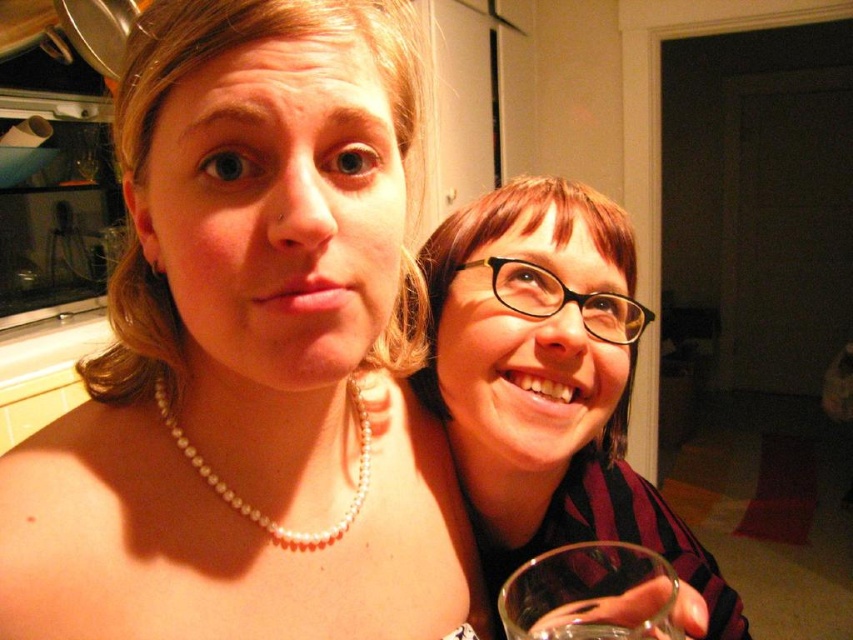
Question: In this image, where is black plastic glasses at right located relative to transparent glass at lower right?

Choices:
 (A) below
 (B) above

Answer: (B)

Question: Can you confirm if pearl necklace at upper left is bigger than pearl necklace at center?

Choices:
 (A) yes
 (B) no

Answer: (A)

Question: Which is nearer to the pearl necklace at center?

Choices:
 (A) pearl necklace at upper left
 (B) black plastic glasses at right

Answer: (A)

Question: Is pearl necklace at upper left above pearl necklace at center?

Choices:
 (A) no
 (B) yes

Answer: (B)

Question: Which object is closer to the camera taking this photo?

Choices:
 (A) pearl necklace at center
 (B) black plastic glasses at right
 (C) pearl necklace at upper left

Answer: (C)

Question: Which object appears closest to the camera in this image?

Choices:
 (A) pearl necklace at center
 (B) pearl necklace at upper left
 (C) transparent glass at lower right

Answer: (B)